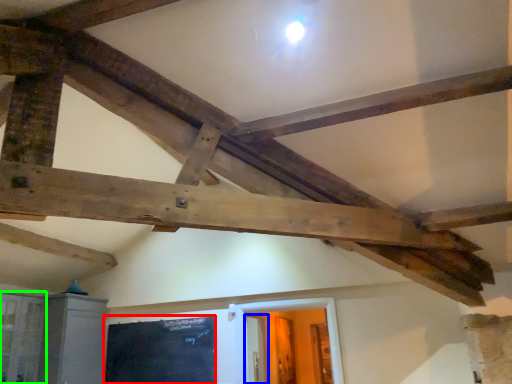
Question: Which object is positioned closest to bulletin board (highlighted by a red box)? Select from door (highlighted by a blue box) and window (highlighted by a green box).

Choices:
 (A) door
 (B) window

Answer: (B)